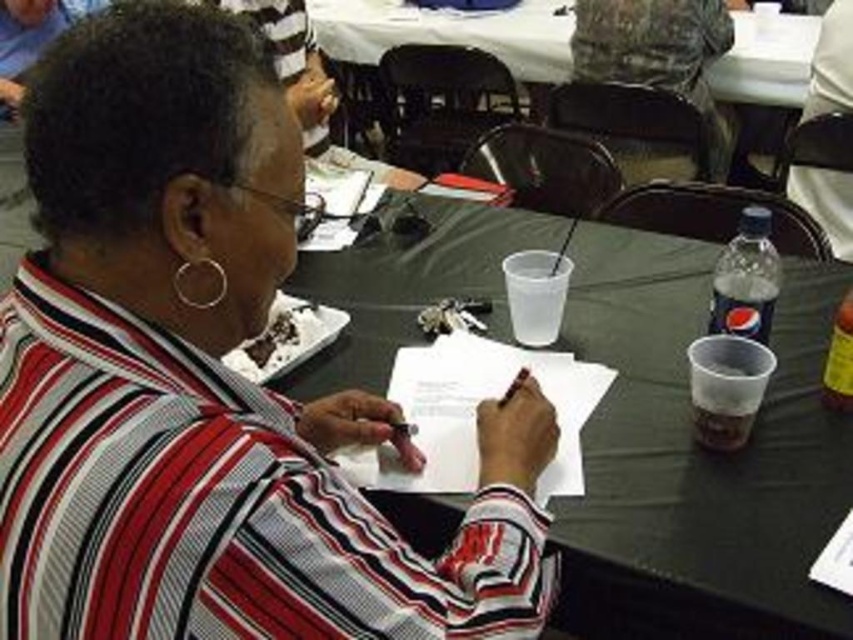
You are a furniture designer observing the scene. You need to determine if the striped fabric shirt at center can be placed on top of the black plastic table at center without any part hanging over the edges. Can it fit?

The striped fabric shirt at center is not as tall as the black plastic table at center, but the description does not provide information about the shirt or table width. Therefore, it is unclear if the shirt can fit without hanging over the edges.

You are designing a new outfit and want to ensure it fits well with the existing scene. Given the striped fabric shirt at center and the black plastic table at center, which item is narrower?

The striped fabric shirt at center has a lesser width compared to the black plastic table at center, so the striped fabric shirt at center is narrower.

You are a waiter in a restaurant and you see the striped fabric shirt at center and the black plastic table at center. Which object is closer to the floor?

The striped fabric shirt at center is positioned under the black plastic table at center, so the striped fabric shirt at center is closer to the floor.